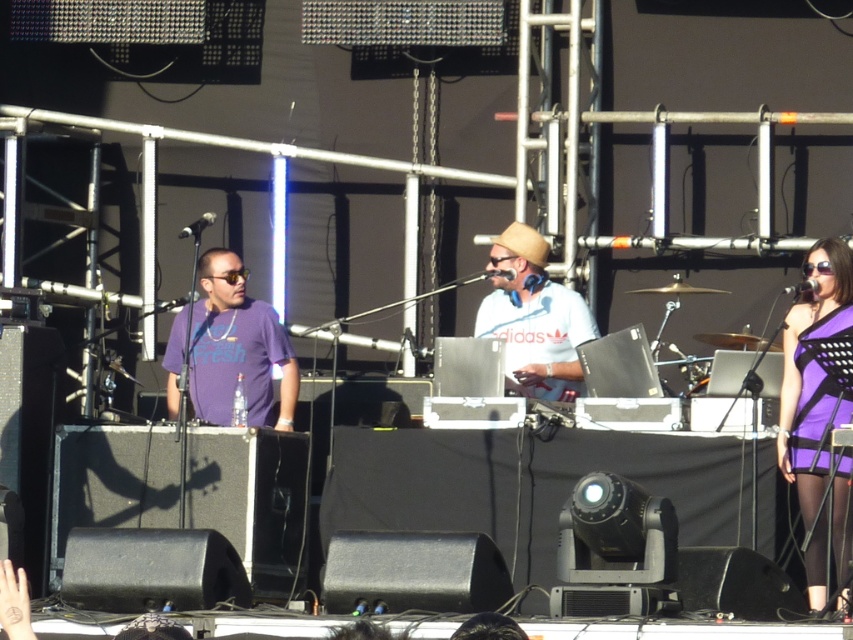
Does purple mesh dress at right appear on the left side of white matte hat at center?

Incorrect, purple mesh dress at right is not on the left side of white matte hat at center.

Can you confirm if purple mesh dress at right is bigger than white matte hat at center?

Actually, purple mesh dress at right might be smaller than white matte hat at center.

Who is more distant from viewer, [837,266] or [508,323]?

The point [508,323] is behind.

The height and width of the screenshot is (640, 853). In order to click on purple mesh dress at right in this screenshot , I will do `click(813, 396)`.

Who is positioned more to the right, purple matte shirt at center or white matte hat at center?

white matte hat at center is more to the right.

Can you confirm if purple matte shirt at center is taller than white matte hat at center?

Correct, purple matte shirt at center is much taller as white matte hat at center.

Describe the element at coordinates (236, 348) in the screenshot. I see `purple matte shirt at center` at that location.

The height and width of the screenshot is (640, 853). Find the location of `purple matte shirt at center`. purple matte shirt at center is located at coordinates pos(236,348).

Is point (801, 410) in front of point (236, 332)?

Yes, point (801, 410) is in front of point (236, 332).

Where is `purple mesh dress at right`? Image resolution: width=853 pixels, height=640 pixels. purple mesh dress at right is located at coordinates (813, 396).